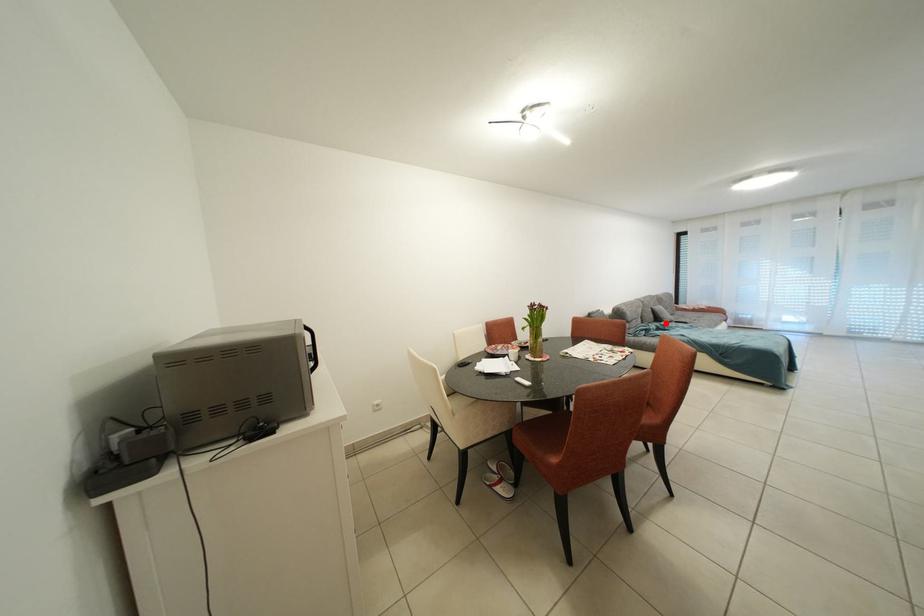
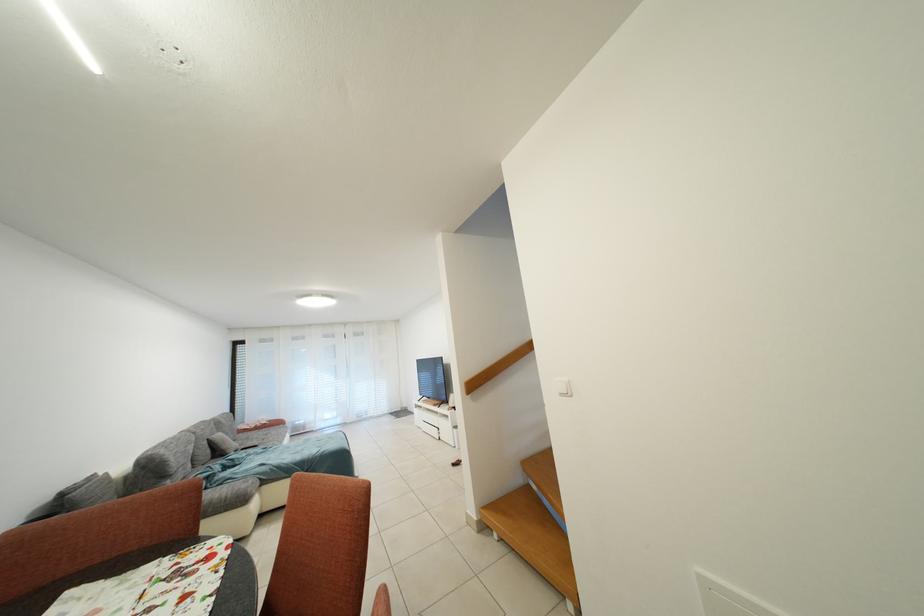
The point at the highlighted location is marked in the first image. Where is the corresponding point in the second image?

(226, 456)